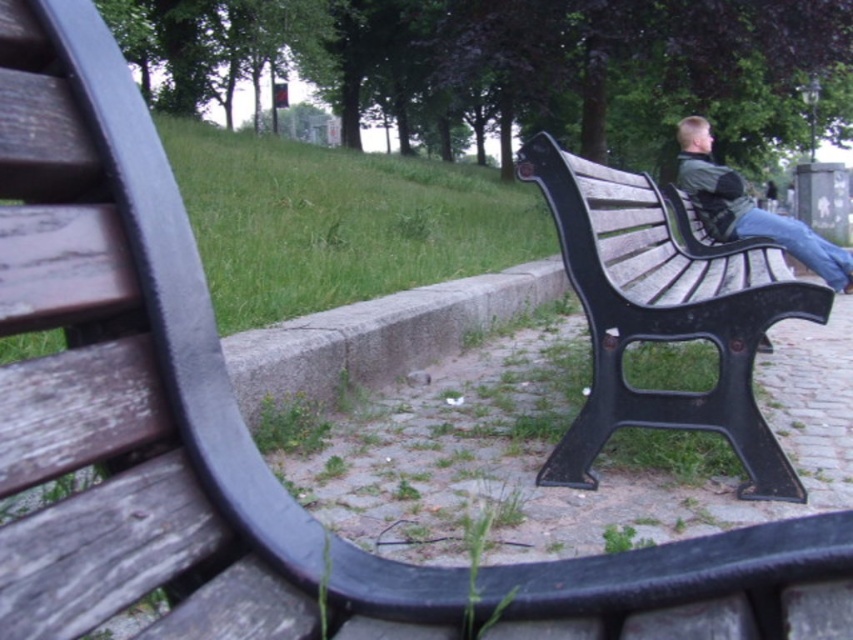
You are standing in the park and see two points marked in the image. Which point is closer to you? The points are point [662,256] and point [828,268].

Point [662,256] is closer to the viewer than point [828,268].